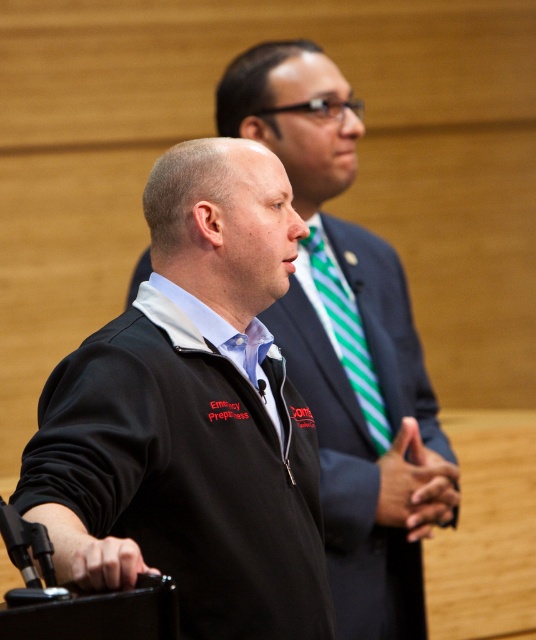
You are organizing a formal event and need to arrange seating for two attendees. The attendees are wearing a black matte jacket at center and a dark blue suit at center. Based on their positions in the image, which attendee should be seated to the right side of the table to maintain their original spatial relationship?

The dark blue suit at center should be seated to the right side of the table because the black matte jacket at center is to the left of the dark blue suit at center in the image.

You are an event organizer who needs to arrange seating for two people based on their clothing. You see a black matte jacket at center and a dark blue suit at center. Which clothing item belongs to the taller person?

The black matte jacket at center belongs to the taller person because it is much taller than the dark blue suit at center.

You are an event organizer arranging seating for a presentation. You need to place two identical black jackets on chairs in the front row. The jackets are labeled as black fleece jacket at center and black matte jacket at center. According to the image, which jacket should be placed to the left of the other?

The black fleece jacket at center should be placed to the left of the black matte jacket at center because the description states that the black fleece jacket at center is to the left of the black matte jacket at center.